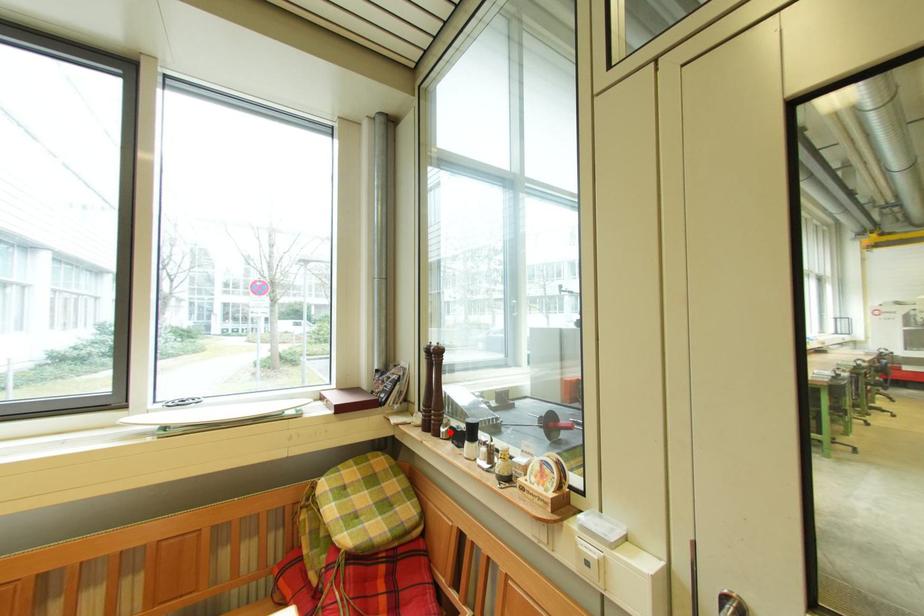
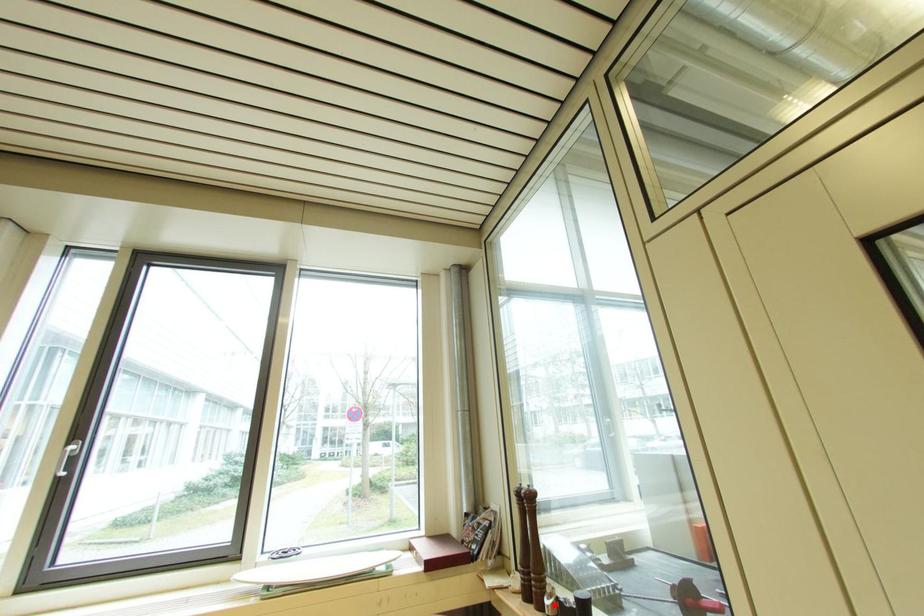
I am providing you with two images of the same scene from different viewpoints. A red point is marked on the first image and another point is marked on the second image. Is the red point in image1 aligned with the point shown in image2?

Yes